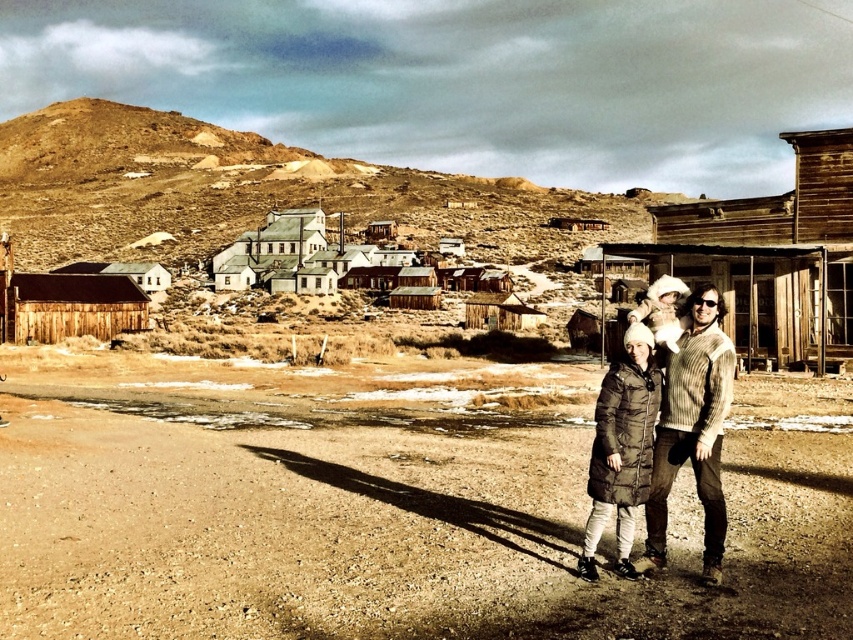
Does wooden hut at center-right lie in front of brown puffy coat at lower right?

No, wooden hut at center-right is further to the viewer.

Is wooden hut at center-right further to the viewer compared to brown puffy coat at lower right?

Yes, wooden hut at center-right is behind brown puffy coat at lower right.

Who is more forward, [836,332] or [622,428]?

Point [622,428] is in front.

You are a GUI agent. You are given a task and a screenshot of the screen. Output one action in this format:
    pyautogui.click(x=<x>, y=<y>)
    Task: Click on the wooden hut at center-right
    Image resolution: width=853 pixels, height=640 pixels.
    Given the screenshot: What is the action you would take?
    pyautogui.click(x=772, y=257)

Describe the element at coordinates (384, 512) in the screenshot. Image resolution: width=853 pixels, height=640 pixels. I see `brown dirt field at lower center` at that location.

Which is above, brown dirt field at lower center or brown puffy coat at lower right?

brown dirt field at lower center is above.

This screenshot has height=640, width=853. Find the location of `brown dirt field at lower center`. brown dirt field at lower center is located at coordinates (384, 512).

Does wooden hut at center-right appear on the left side of wooden hut at center?

Incorrect, wooden hut at center-right is not on the left side of wooden hut at center.

Between wooden hut at center-right and wooden hut at center, which one appears on the left side from the viewer's perspective?

From the viewer's perspective, wooden hut at center appears more on the left side.

The height and width of the screenshot is (640, 853). Identify the location of wooden hut at center-right. (772, 257).